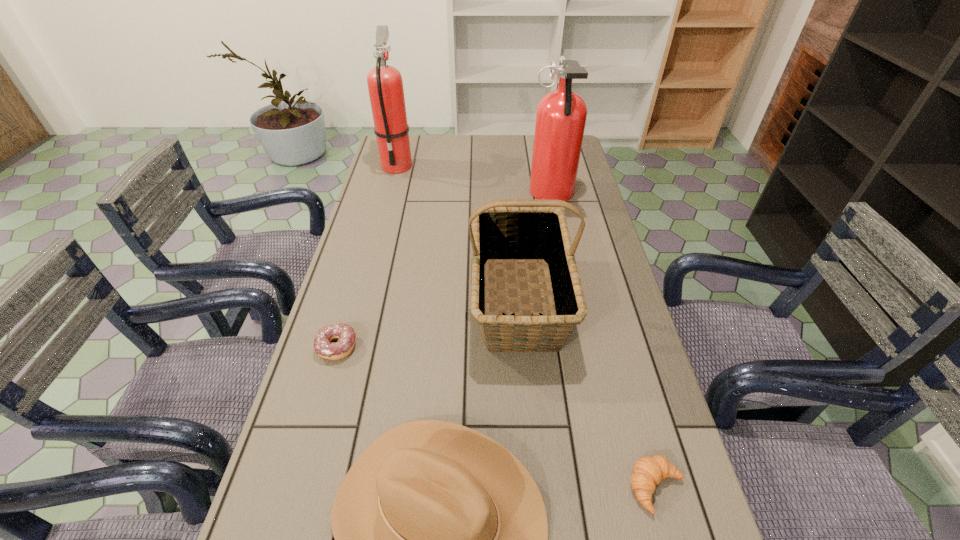
Identify the location of object that is positioned at the far edge. Image resolution: width=960 pixels, height=540 pixels. (385, 85).

Find the location of a particular element. This screenshot has width=960, height=540. fire extinguisher at the left edge is located at coordinates (385, 85).

Find the location of a particular element. doughnut that is positioned at the left edge is located at coordinates click(x=343, y=347).

Where is `fire extinguisher that is at the right edge`? The height and width of the screenshot is (540, 960). fire extinguisher that is at the right edge is located at coordinates (561, 115).

Locate an element on the screen. This screenshot has width=960, height=540. basket situated at the right edge is located at coordinates (509, 231).

What are the coordinates of `crescent roll that is at the right edge` in the screenshot? It's located at (648, 471).

At what (x,y) coordinates should I click in order to perform the action: click on object situated at the far left corner. Please return your answer as a coordinate pair (x, y). The image size is (960, 540). Looking at the image, I should click on click(385, 85).

Where is `free space at the left edge of the desktop`? Image resolution: width=960 pixels, height=540 pixels. free space at the left edge of the desktop is located at coordinates (379, 282).

Find the location of `vacant point at the right edge`. vacant point at the right edge is located at coordinates (656, 447).

The height and width of the screenshot is (540, 960). I want to click on blank region between the left fire extinguisher and the third tallest object, so click(459, 233).